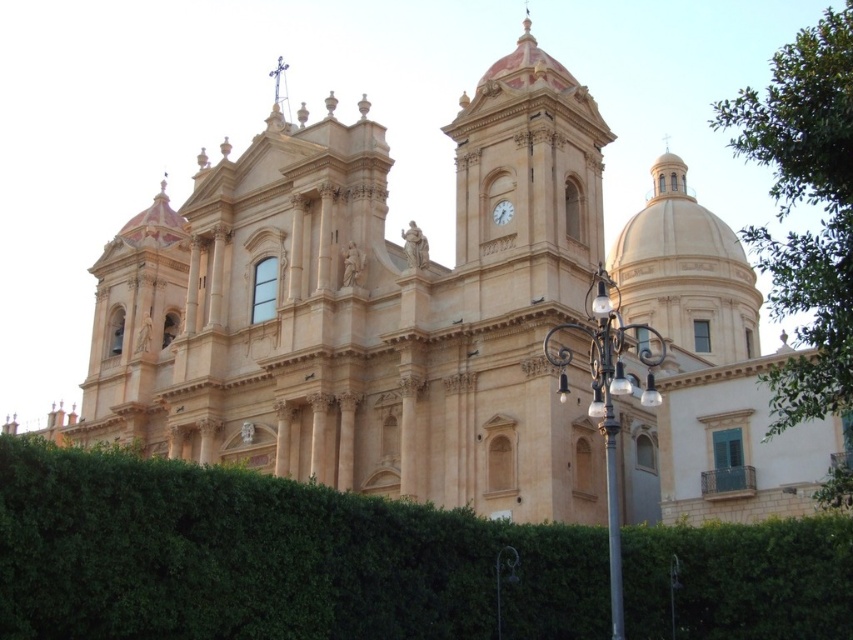
Question: Is green leafy bush at center below black wrought iron streetlight at lower right?

Choices:
 (A) no
 (B) yes

Answer: (B)

Question: Which object is farther from the camera taking this photo?

Choices:
 (A) black wrought iron streetlight at lower right
 (B) metallic pole at center
 (C) green leafy bush at center

Answer: (A)

Question: In this image, where is black wrought iron streetlight at lower right located relative to metallic pole at center?

Choices:
 (A) below
 (B) above

Answer: (B)

Question: Which object appears closest to the camera in this image?

Choices:
 (A) white glossy clock at upper right
 (B) green leafy tree at upper right
 (C) green leafy bush at center
 (D) metallic pole at center

Answer: (B)

Question: From the image, what is the correct spatial relationship of black wrought iron streetlight at lower right in relation to metallic pole at center?

Choices:
 (A) above
 (B) below

Answer: (A)

Question: Which point is closer to the camera taking this photo?

Choices:
 (A) (502, 216)
 (B) (276, 604)

Answer: (B)